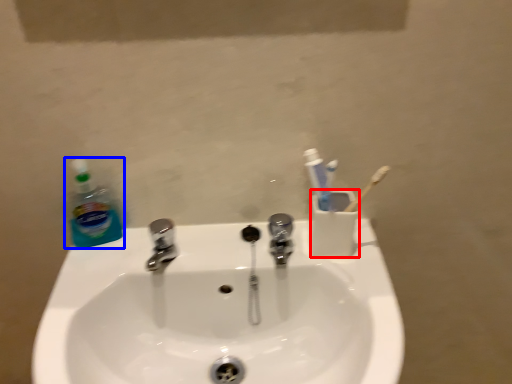
Question: Which object is further to the camera taking this photo, liquid (highlighted by a red box) or cleaning product (highlighted by a blue box)?

Choices:
 (A) liquid
 (B) cleaning product

Answer: (B)